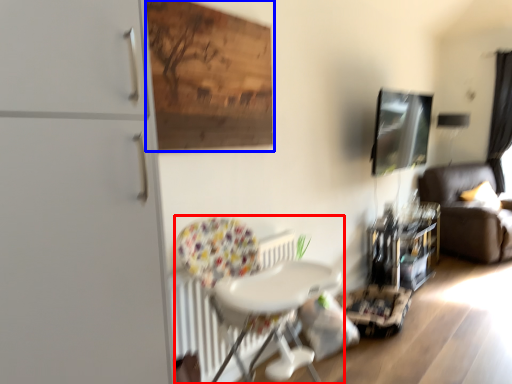
Question: Which object appears closest to the camera in this image, chair (highlighted by a red box) or plywood (highlighted by a blue box)?

Choices:
 (A) chair
 (B) plywood

Answer: (A)